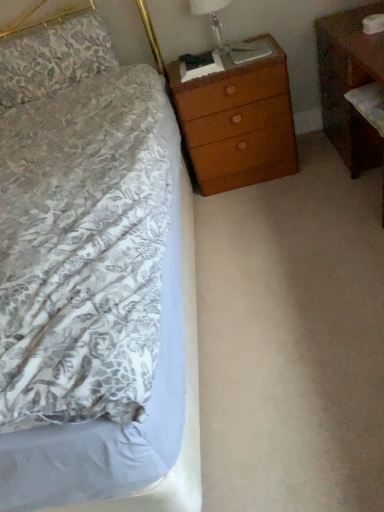
Question: From the image's perspective, is translucent glass lampshade at upper right below floral fabric pillow at upper left?

Choices:
 (A) yes
 (B) no

Answer: (B)

Question: Is translucent glass lampshade at upper right further to camera compared to floral fabric pillow at upper left?

Choices:
 (A) yes
 (B) no

Answer: (A)

Question: From a real-world perspective, is translucent glass lampshade at upper right positioned under floral fabric pillow at upper left based on gravity?

Choices:
 (A) yes
 (B) no

Answer: (A)

Question: Are translucent glass lampshade at upper right and floral fabric pillow at upper left far apart?

Choices:
 (A) yes
 (B) no

Answer: (B)

Question: Can you confirm if translucent glass lampshade at upper right is smaller than floral fabric pillow at upper left?

Choices:
 (A) no
 (B) yes

Answer: (B)

Question: Is floral fabric pillow at upper left a part of translucent glass lampshade at upper right?

Choices:
 (A) no
 (B) yes

Answer: (A)

Question: Considering the relative sizes of floral fabric pillow at upper left and wooden chest of drawers at upper right in the image provided, is floral fabric pillow at upper left wider than wooden chest of drawers at upper right?

Choices:
 (A) no
 (B) yes

Answer: (A)

Question: Is floral fabric pillow at upper left positioned far away from wooden chest of drawers at upper right?

Choices:
 (A) no
 (B) yes

Answer: (A)

Question: From a real-world perspective, is floral fabric pillow at upper left positioned under wooden chest of drawers at upper right based on gravity?

Choices:
 (A) yes
 (B) no

Answer: (B)

Question: Is floral fabric pillow at upper left to the left of wooden chest of drawers at upper right from the viewer's perspective?

Choices:
 (A) yes
 (B) no

Answer: (A)

Question: Does floral fabric pillow at upper left contain wooden chest of drawers at upper right?

Choices:
 (A) yes
 (B) no

Answer: (B)

Question: Can you confirm if floral fabric pillow at upper left is thinner than wooden chest of drawers at upper right?

Choices:
 (A) no
 (B) yes

Answer: (B)

Question: From the image's perspective, is brown wood nightstand at right over wooden chest of drawers at upper right?

Choices:
 (A) no
 (B) yes

Answer: (A)